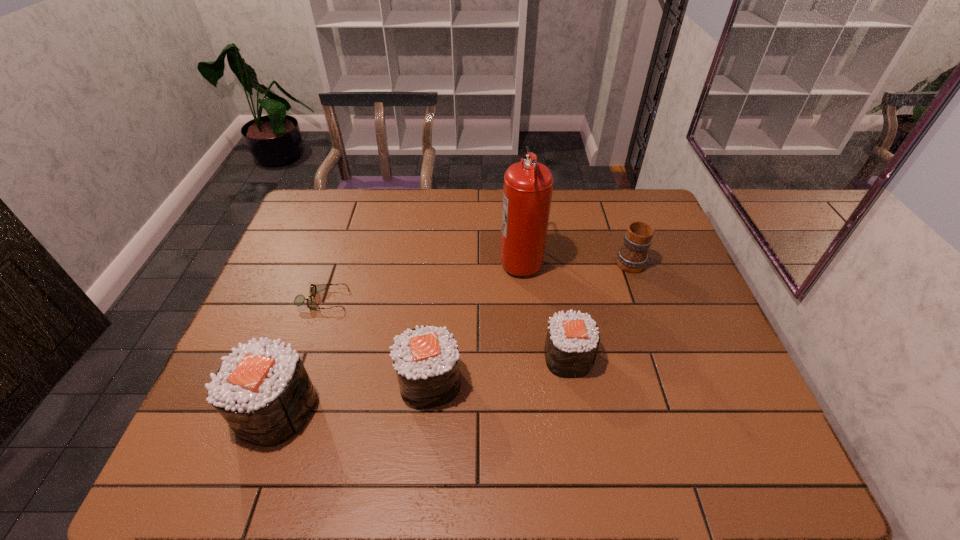
Find the location of a particular element. object that is at the right edge is located at coordinates (632, 257).

At what (x,y) coordinates should I click in order to perform the action: click on object that is at the near left corner. Please return your answer as a coordinate pair (x, y). Image resolution: width=960 pixels, height=540 pixels. Looking at the image, I should click on (263, 391).

At what (x,y) coordinates should I click in order to perform the action: click on free space at the far edge of the desktop. Please return your answer as a coordinate pair (x, y). The image size is (960, 540). Looking at the image, I should click on (557, 206).

Where is `blank space at the near edge of the desktop`? Image resolution: width=960 pixels, height=540 pixels. blank space at the near edge of the desktop is located at coordinates (679, 420).

At what (x,y) coordinates should I click in order to perform the action: click on free space at the left edge of the desktop. Please return your answer as a coordinate pair (x, y). The height and width of the screenshot is (540, 960). Looking at the image, I should click on (298, 308).

The height and width of the screenshot is (540, 960). In the image, there is a desktop. Identify the location of free space at the right edge. (x=674, y=256).

In the image, there is a desktop. Where is `vacant space at the far left corner`? This screenshot has width=960, height=540. vacant space at the far left corner is located at coordinates (308, 230).

This screenshot has width=960, height=540. Find the location of `vacant space at the far right corner of the desktop`. vacant space at the far right corner of the desktop is located at coordinates (624, 191).

At what (x,y) coordinates should I click in order to perform the action: click on vacant area that lies between the tallest object and the third farthest object. Please return your answer as a coordinate pair (x, y). This screenshot has height=540, width=960. Looking at the image, I should click on (422, 279).

The image size is (960, 540). I want to click on free space between the mug and the second sushi from left to right, so click(x=529, y=321).